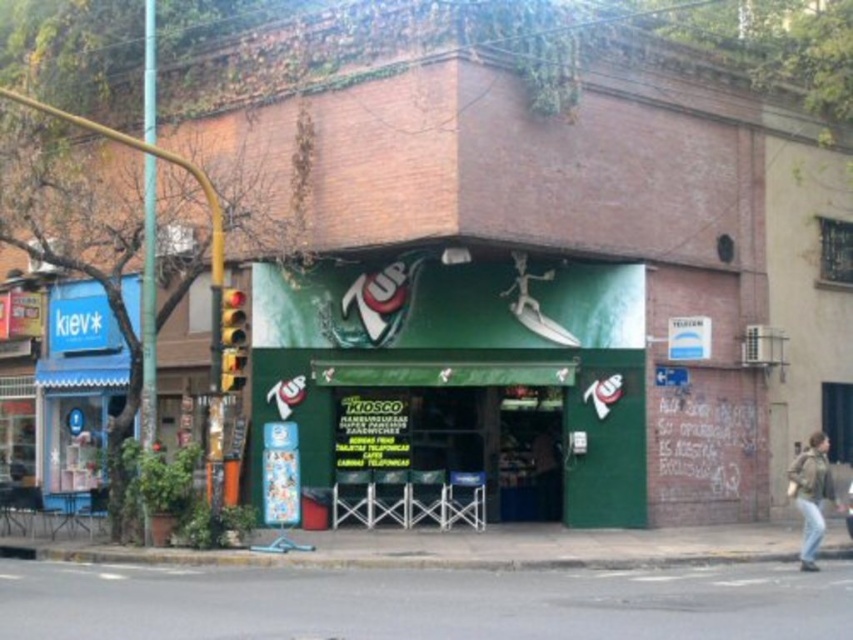
You are a delivery person with a 4 meter wide package that needs to be moved through the path between the green leather jacket at lower right and the light brown leather jacket at lower right. Can the package fit through the space between them?

The distance between the green leather jackets at lower right and the light brown leather jacket at lower right is 3.98 meters. Since the package is 4 meters wide, it is slightly wider than the available space, so the package cannot fit through the path between them.

You are standing in front of the 7UP kiosk and notice two points marked on the facade. The first point is at coordinate point (817,486) and the second is at point (851,504). Which point is closer to you?

Point (817,486) is closer to the viewer than point (851,504).

You are a delivery person who needs to hang a new sign above the green leather jacket at lower right. The new sign must be exactly the same height as the green matte signboard at center. Is this possible?

The green matte signboard at center is shorter than the green leather jacket at lower right. Therefore, the new sign cannot be the same height as the green matte signboard at center because it needs to be hung above the green leather jacket at lower right, which is taller.